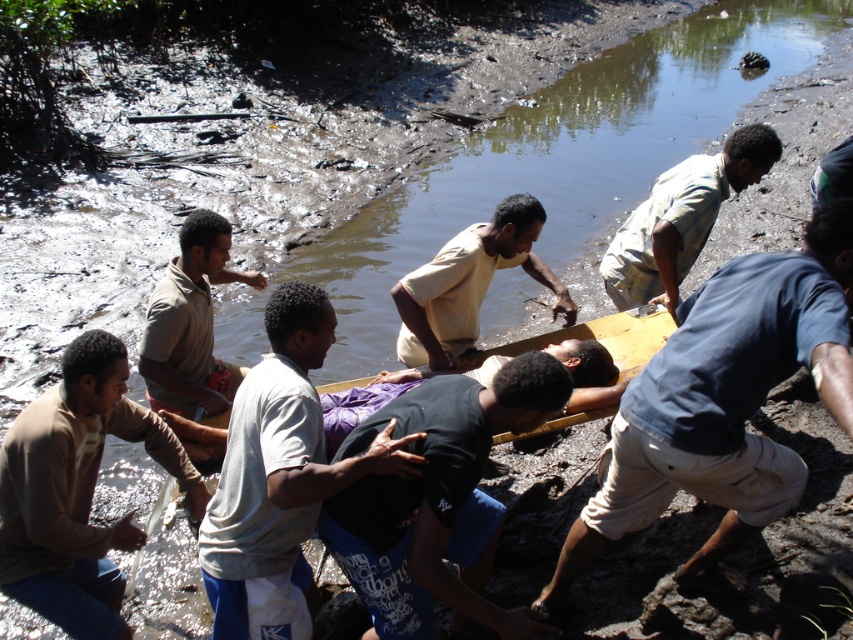
Question: Which of the following is the closest to the observer?

Choices:
 (A) blue cotton shirt at right
 (B) light beige shirt at center

Answer: (A)

Question: Is blue cotton shirt at right bigger than light blue plaid shirt at upper right?

Choices:
 (A) no
 (B) yes

Answer: (B)

Question: Can you confirm if blue cotton shirt at right is positioned to the left of light beige shirt at center?

Choices:
 (A) yes
 (B) no

Answer: (B)

Question: Is light gray cotton shirt at center positioned before light blue plaid shirt at upper right?

Choices:
 (A) no
 (B) yes

Answer: (B)

Question: Which object is the farthest from the matte beige shirt at left?

Choices:
 (A) light gray cotton shirt at center
 (B) black matte shirt at center
 (C) light beige shirt at center

Answer: (B)

Question: Which of the following is the farthest from the observer?

Choices:
 (A) (416, 435)
 (B) (483, 253)
 (C) (380, 536)
 (D) (202, 216)

Answer: (D)